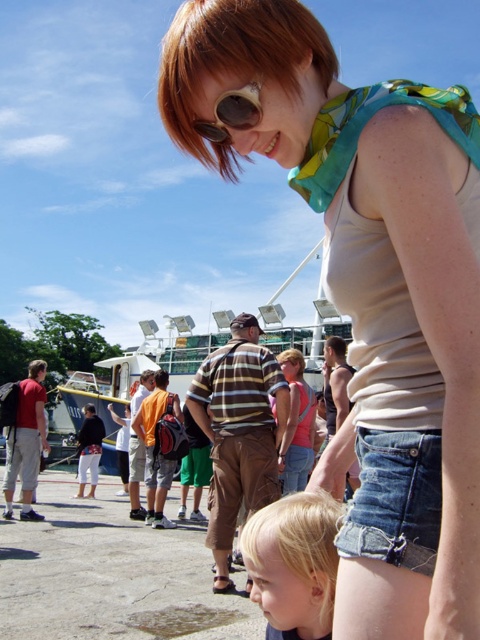
Question: Which of the following is the farthest from the observer?

Choices:
 (A) blonde hair at lower left
 (B) matte beige tank top at center

Answer: (A)

Question: Which object is positioned closest to the brown leather goggles at upper center?

Choices:
 (A) matte beige tank top at center
 (B) white plastic boat at center
 (C) orange fabric backpack at center

Answer: (A)

Question: Can you confirm if white plastic boat at center is bigger than brown leather goggles at upper center?

Choices:
 (A) no
 (B) yes

Answer: (B)

Question: Which of the following is the closest to the observer?

Choices:
 (A) white plastic boat at center
 (B) blonde hair at lower left
 (C) brown leather goggles at upper center

Answer: (C)

Question: Is matte beige tank top at center positioned behind white plastic boat at center?

Choices:
 (A) no
 (B) yes

Answer: (A)

Question: Is blonde hair at lower left bigger than orange fabric backpack at center?

Choices:
 (A) no
 (B) yes

Answer: (A)